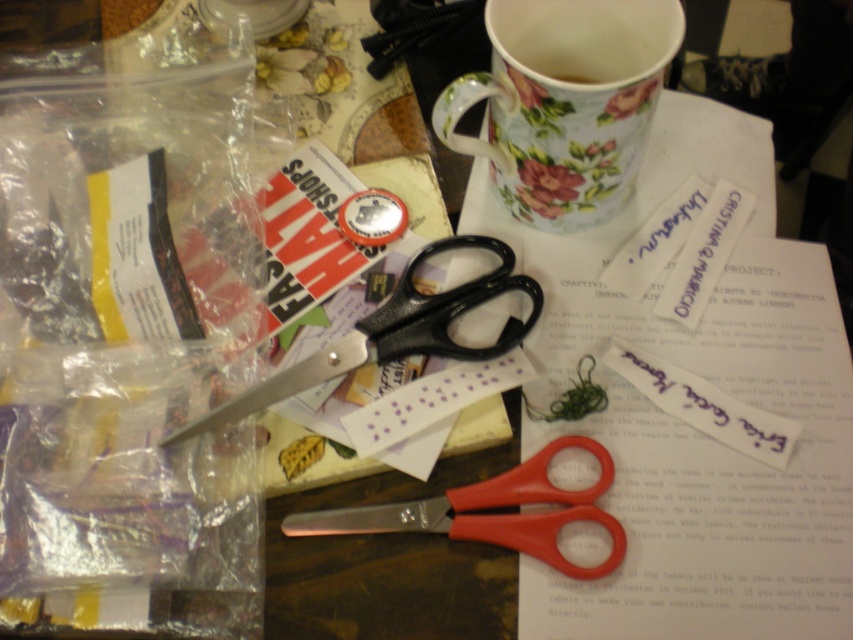
Question: Which point appears farthest from the camera in this image?

Choices:
 (A) (757, 403)
 (B) (527, 317)

Answer: (B)

Question: Which of these objects is positioned farthest from the white paper at upper center?

Choices:
 (A) black plastic scissors at center
 (B) floral ceramic mug at upper center
 (C) metallic red scissors at center

Answer: (A)

Question: Does white paper at upper center have a greater width compared to floral ceramic mug at upper center?

Choices:
 (A) no
 (B) yes

Answer: (B)

Question: Which point is closer to the camera?

Choices:
 (A) (643, 548)
 (B) (355, 532)
 (C) (670, 28)

Answer: (A)

Question: Is floral ceramic mug at upper center further to camera compared to metallic red scissors at center?

Choices:
 (A) no
 (B) yes

Answer: (A)

Question: Is floral ceramic mug at upper center behind black plastic scissors at center?

Choices:
 (A) yes
 (B) no

Answer: (B)